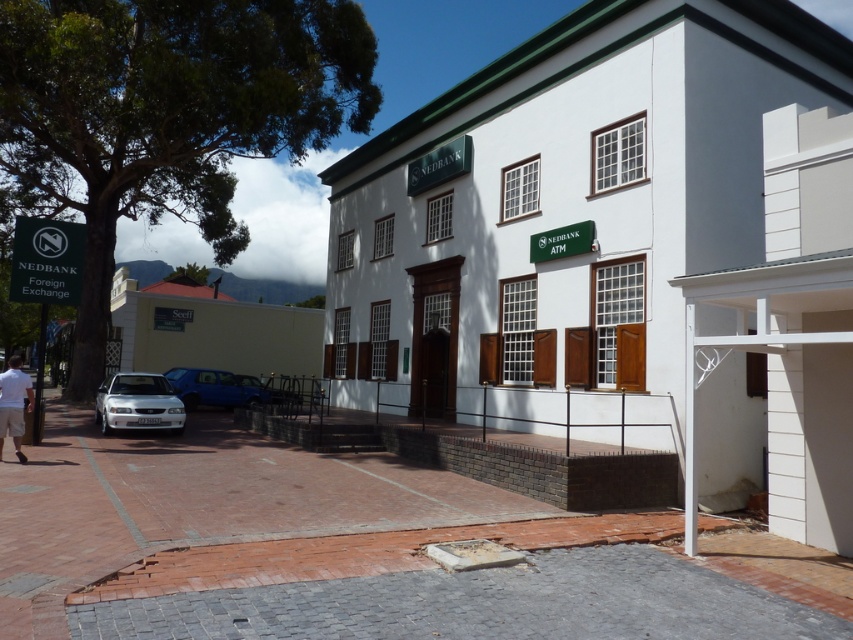
Question: Among these points, which one is nearest to the camera?

Choices:
 (A) (9, 381)
 (B) (96, 417)

Answer: (A)

Question: Which of the following is the farthest from the observer?

Choices:
 (A) metallic blue van at center
 (B) light brown shorts at lower left
 (C) white matte sedan at lower left

Answer: (A)

Question: Among these points, which one is farthest from the camera?

Choices:
 (A) (222, 372)
 (B) (19, 426)

Answer: (A)

Question: Does white matte sedan at lower left lie in front of light brown shorts at lower left?

Choices:
 (A) no
 (B) yes

Answer: (A)

Question: Is metallic blue van at center closer to the viewer compared to light brown shorts at lower left?

Choices:
 (A) yes
 (B) no

Answer: (B)

Question: Does white matte sedan at lower left appear over light brown shorts at lower left?

Choices:
 (A) yes
 (B) no

Answer: (B)